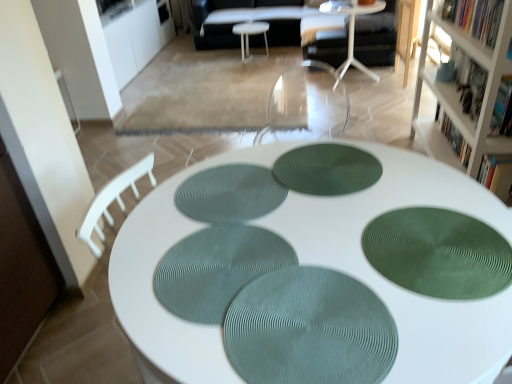
Locate an element on the screen. free space in front of teal textured placemat at center, the third mat viewed from the right is located at coordinates (255, 348).